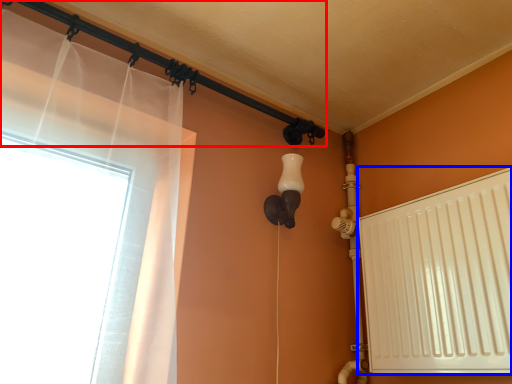
Question: Which point is further to the camera, pipe (highlighted by a red box) or radiator (highlighted by a blue box)?

Choices:
 (A) pipe
 (B) radiator

Answer: (A)